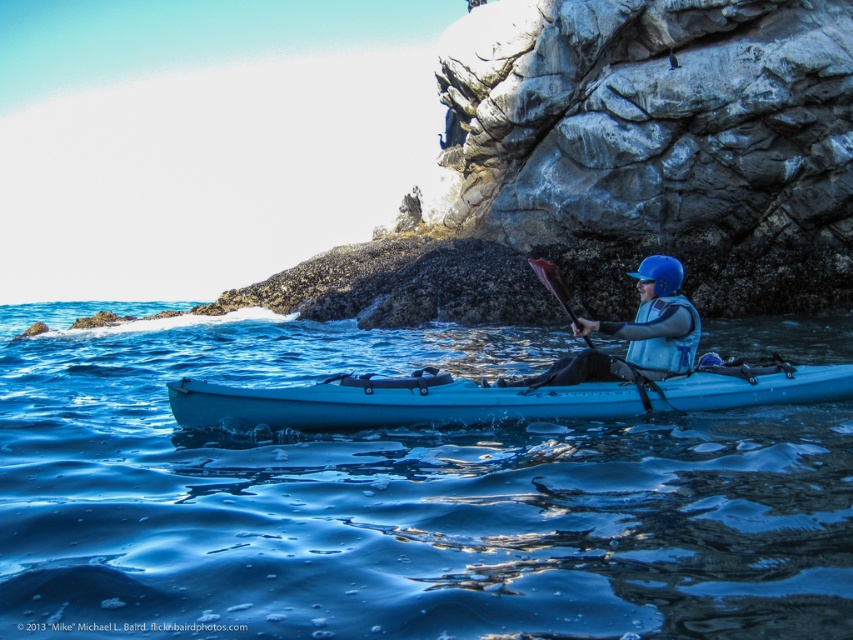
Is point (482, 593) in front of point (666, 401)?

Yes, it is.

Is blue glossy water at center closer to camera compared to light blue plastic canoe at center?

That is True.

Which is in front, point (683, 536) or point (184, 384)?

Point (683, 536) is in front.

Where is `blue glossy water at center`? This screenshot has width=853, height=640. blue glossy water at center is located at coordinates (395, 497).

Does blue glossy water at center come in front of blue matte helmet at center?

Yes, it is in front of blue matte helmet at center.

Consider the image. Which of these two, blue glossy water at center or blue matte helmet at center, stands shorter?

blue matte helmet at center is shorter.

Locate an element on the screen. This screenshot has height=640, width=853. blue glossy water at center is located at coordinates (395, 497).

This screenshot has width=853, height=640. I want to click on blue glossy water at center, so click(395, 497).

Does light blue plastic canoe at center appear over blue matte helmet at center?

No.

Can you confirm if light blue plastic canoe at center is wider than blue matte helmet at center?

Indeed, light blue plastic canoe at center has a greater width compared to blue matte helmet at center.

You are a GUI agent. You are given a task and a screenshot of the screen. Output one action in this format:
    pyautogui.click(x=<x>, y=<y>)
    Task: Click on the light blue plastic canoe at center
    Image resolution: width=853 pixels, height=640 pixels.
    Given the screenshot: What is the action you would take?
    pyautogui.click(x=486, y=397)

You are a GUI agent. You are given a task and a screenshot of the screen. Output one action in this format:
    pyautogui.click(x=<x>, y=<y>)
    Task: Click on the light blue plastic canoe at center
    The image size is (853, 640).
    Given the screenshot: What is the action you would take?
    pyautogui.click(x=486, y=397)